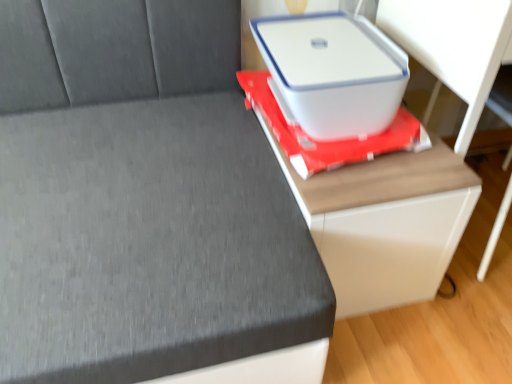
Question: Can you confirm if white matte computer desk at right is smaller than white glossy table at center?

Choices:
 (A) no
 (B) yes

Answer: (A)

Question: Is there a large distance between white matte computer desk at right and white glossy table at center?

Choices:
 (A) yes
 (B) no

Answer: (B)

Question: Is white matte computer desk at right not within white glossy table at center?

Choices:
 (A) no
 (B) yes

Answer: (B)

Question: Is white glossy table at center a part of white matte computer desk at right?

Choices:
 (A) yes
 (B) no

Answer: (B)

Question: Can you confirm if white matte computer desk at right is bigger than white glossy table at center?

Choices:
 (A) no
 (B) yes

Answer: (B)

Question: Is white plastic container at upper right wider or thinner than white plastic storage box at upper right?

Choices:
 (A) thin
 (B) wide

Answer: (B)

Question: Do you think white plastic container at upper right is within white plastic storage box at upper right, or outside of it?

Choices:
 (A) inside
 (B) outside

Answer: (B)

Question: Relative to white plastic storage box at upper right, is white plastic container at upper right in front or behind?

Choices:
 (A) front
 (B) behind

Answer: (A)

Question: Visually, is white plastic container at upper right positioned to the left or to the right of white plastic storage box at upper right?

Choices:
 (A) left
 (B) right

Answer: (A)

Question: From the image's perspective, is white matte computer desk at right above or below white plastic container at upper right?

Choices:
 (A) above
 (B) below

Answer: (A)

Question: Is point (458, 147) positioned closer to the camera than point (271, 367)?

Choices:
 (A) farther
 (B) closer

Answer: (A)

Question: Based on their sizes in the image, would you say white matte computer desk at right is bigger or smaller than white plastic container at upper right?

Choices:
 (A) small
 (B) big

Answer: (A)

Question: In the image, is white matte computer desk at right positioned in front of or behind white plastic container at upper right?

Choices:
 (A) front
 (B) behind

Answer: (B)

Question: Looking at their shapes, would you say white plastic storage box at upper right is wider or thinner than white glossy table at center?

Choices:
 (A) thin
 (B) wide

Answer: (A)

Question: In the image, is white plastic storage box at upper right positioned in front of or behind white glossy table at center?

Choices:
 (A) front
 (B) behind

Answer: (B)